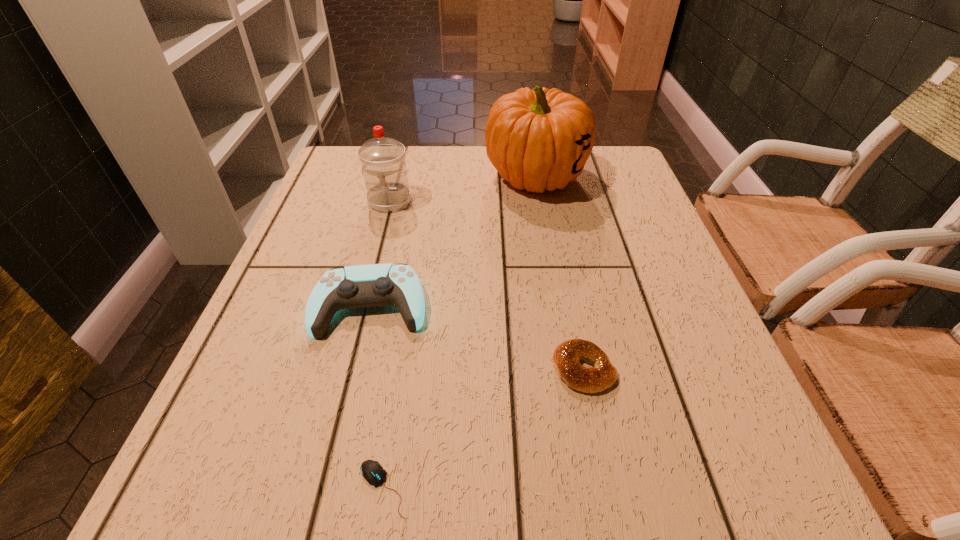
Locate an element on the screen. The image size is (960, 540). vacant space that satisfies the following two spatial constraints: 1. on the handle side of the bagel; 2. on the left side of the water bottle is located at coordinates (347, 369).

Where is `vacant position in the image that satisfies the following two spatial constraints: 1. on the handle side of the second tallest object; 2. on the left side of the fourth tallest object`? Image resolution: width=960 pixels, height=540 pixels. vacant position in the image that satisfies the following two spatial constraints: 1. on the handle side of the second tallest object; 2. on the left side of the fourth tallest object is located at coordinates (347, 369).

Identify the location of vacant space that satisfies the following two spatial constraints: 1. on the back side of the mouse; 2. on the right side of the fourth tallest object. (401, 369).

Find the location of a particular element. vacant space that satisfies the following two spatial constraints: 1. on the back side of the bagel; 2. on the right side of the nearest object is located at coordinates (401, 369).